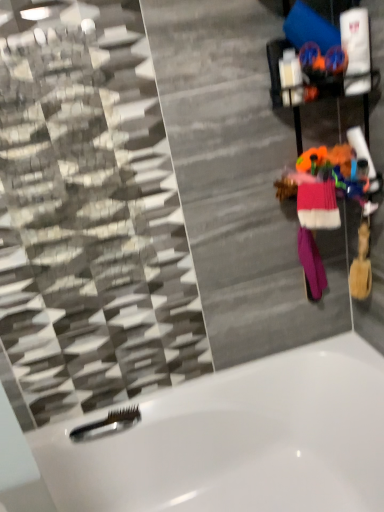
Question: Does purple knitted mittens at right, which ranks as the 2th clothing in front-to-back order, lie in front of pink knitted sweater at right, which is counted as the second clothing, starting from the back?

Choices:
 (A) no
 (B) yes

Answer: (A)

Question: From a real-world perspective, is purple knitted mittens at right, placed as the 1th clothing when sorted from back to front, below pink knitted sweater at right, which is counted as the second clothing, starting from the back?

Choices:
 (A) yes
 (B) no

Answer: (A)

Question: From the image's perspective, is purple knitted mittens at right, which ranks as the 2th clothing in front-to-back order, on top of pink knitted sweater at right, which is counted as the second clothing, starting from the back?

Choices:
 (A) yes
 (B) no

Answer: (B)

Question: Is purple knitted mittens at right, which ranks as the 2th clothing in front-to-back order, not inside pink knitted sweater at right, which is counted as the second clothing, starting from the back?

Choices:
 (A) no
 (B) yes

Answer: (B)

Question: Is purple knitted mittens at right, which ranks as the 2th clothing in front-to-back order, shorter than pink knitted sweater at right, which is counted as the second clothing, starting from the back?

Choices:
 (A) no
 (B) yes

Answer: (A)

Question: Do you think white glossy bathtub at lower center is within purple knitted mittens at right, placed as the 1th clothing when sorted from back to front, or outside of it?

Choices:
 (A) inside
 (B) outside

Answer: (B)

Question: Is point pyautogui.click(x=66, y=476) closer or farther from the camera than point pyautogui.click(x=309, y=286)?

Choices:
 (A) closer
 (B) farther

Answer: (A)

Question: Considering the positions of white glossy bathtub at lower center and purple knitted mittens at right, placed as the 1th clothing when sorted from back to front, in the image, is white glossy bathtub at lower center wider or thinner than purple knitted mittens at right, placed as the 1th clothing when sorted from back to front,?

Choices:
 (A) thin
 (B) wide

Answer: (B)

Question: From their relative heights in the image, would you say white glossy bathtub at lower center is taller or shorter than purple knitted mittens at right, which ranks as the 2th clothing in front-to-back order?

Choices:
 (A) short
 (B) tall

Answer: (B)

Question: Considering the positions of white glossy bathtub at lower center and black plastic comb at lower left in the image, is white glossy bathtub at lower center bigger or smaller than black plastic comb at lower left?

Choices:
 (A) small
 (B) big

Answer: (B)

Question: From the image's perspective, is white glossy bathtub at lower center positioned above or below black plastic comb at lower left?

Choices:
 (A) above
 (B) below

Answer: (B)

Question: Choose the correct answer: Is white glossy bathtub at lower center inside black plastic comb at lower left or outside it?

Choices:
 (A) outside
 (B) inside

Answer: (A)

Question: From a real-world perspective, is white glossy bathtub at lower center positioned above or below black plastic comb at lower left?

Choices:
 (A) below
 (B) above

Answer: (A)

Question: Is black plastic comb at lower left taller or shorter than pink knitted sweater at right, which is counted as the second clothing, starting from the back?

Choices:
 (A) tall
 (B) short

Answer: (B)

Question: Considering the positions of black plastic comb at lower left and pink knitted sweater at right, the 1th clothing viewed from the front, in the image, is black plastic comb at lower left bigger or smaller than pink knitted sweater at right, the 1th clothing viewed from the front,?

Choices:
 (A) small
 (B) big

Answer: (A)